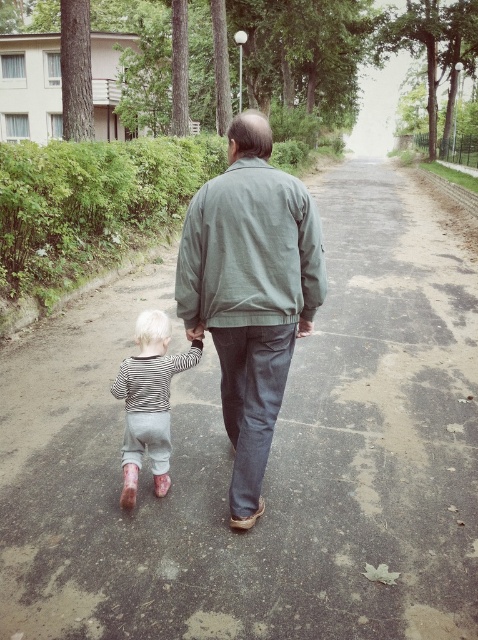
Question: Which of the following is the farthest from the observer?

Choices:
 (A) gray cotton jacket at center
 (B) striped cotton shirt at lower left

Answer: (B)

Question: In this image, where is gray cotton jacket at center located relative to striped cotton shirt at lower left?

Choices:
 (A) above
 (B) below

Answer: (A)

Question: Can you confirm if gray cotton jacket at center is positioned above striped cotton shirt at lower left?

Choices:
 (A) no
 (B) yes

Answer: (B)

Question: Is gray cotton jacket at center positioned before striped cotton shirt at lower left?

Choices:
 (A) yes
 (B) no

Answer: (A)

Question: Among these points, which one is nearest to the camera?

Choices:
 (A) (153, 432)
 (B) (239, 444)

Answer: (B)